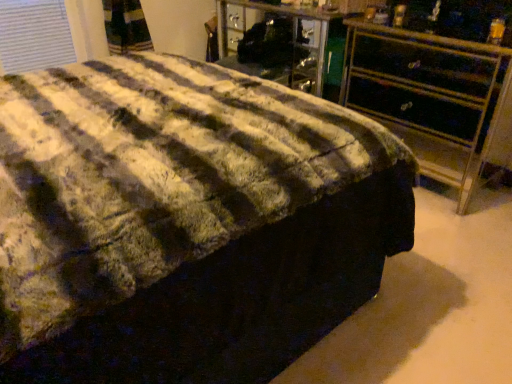
The height and width of the screenshot is (384, 512). What do you see at coordinates (185, 221) in the screenshot?
I see `fluffy fabric bed at center` at bounding box center [185, 221].

I want to click on fluffy fabric bed at center, so click(185, 221).

At what (x,y) coordinates should I click in order to perform the action: click on metallic gold chest of drawers at right. Please return your answer as a coordinate pair (x, y). Looking at the image, I should click on (433, 98).

The height and width of the screenshot is (384, 512). Describe the element at coordinates (433, 98) in the screenshot. I see `metallic gold chest of drawers at right` at that location.

You are a GUI agent. You are given a task and a screenshot of the screen. Output one action in this format:
    pyautogui.click(x=<x>, y=<y>)
    Task: Click on the fluffy fabric bed at center
    
    Given the screenshot: What is the action you would take?
    pyautogui.click(x=185, y=221)

Can you confirm if fluffy fabric bed at center is positioned to the right of metallic gold chest of drawers at right?

In fact, fluffy fabric bed at center is to the left of metallic gold chest of drawers at right.

Is fluffy fabric bed at center behind metallic gold chest of drawers at right?

No, the depth of fluffy fabric bed at center is less than that of metallic gold chest of drawers at right.

Which is nearer, [218,141] or [445,123]?

Point [218,141] appears to be closer to the viewer than point [445,123].

From the image's perspective, is fluffy fabric bed at center located above metallic gold chest of drawers at right?

Actually, fluffy fabric bed at center appears below metallic gold chest of drawers at right in the image.

Looking at this image, from a real-world perspective, is fluffy fabric bed at center on metallic gold chest of drawers at right?

Yes, from a real-world perspective, fluffy fabric bed at center is on top of metallic gold chest of drawers at right.

Looking at their sizes, would you say fluffy fabric bed at center is wider or thinner than metallic gold chest of drawers at right?

Clearly, fluffy fabric bed at center has more width compared to metallic gold chest of drawers at right.

Between fluffy fabric bed at center and metallic gold chest of drawers at right, which one has less height?

With less height is metallic gold chest of drawers at right.

Considering the sizes of fluffy fabric bed at center and metallic gold chest of drawers at right in the image, is fluffy fabric bed at center bigger or smaller than metallic gold chest of drawers at right?

fluffy fabric bed at center is bigger than metallic gold chest of drawers at right.

Is fluffy fabric bed at center not inside metallic gold chest of drawers at right?

Indeed, fluffy fabric bed at center is completely outside metallic gold chest of drawers at right.

Is fluffy fabric bed at center far away from metallic gold chest of drawers at right?

Yes, fluffy fabric bed at center is far from metallic gold chest of drawers at right.

Is fluffy fabric bed at center oriented towards metallic gold chest of drawers at right?

Yes, fluffy fabric bed at center is aimed at metallic gold chest of drawers at right.

How many degrees apart are the facing directions of fluffy fabric bed at center and metallic gold chest of drawers at right?

There is a 177-degree angle between the facing directions of fluffy fabric bed at center and metallic gold chest of drawers at right.

How much distance is there between fluffy fabric bed at center and metallic gold chest of drawers at right?

fluffy fabric bed at center is 3.49 feet away from metallic gold chest of drawers at right.

I want to click on the chest of drawers behind the fluffy fabric bed at center, so click(x=433, y=98).

Which is more to the left, metallic gold chest of drawers at right or fluffy fabric bed at center?

From the viewer's perspective, fluffy fabric bed at center appears more on the left side.

Is the depth of metallic gold chest of drawers at right less than that of fluffy fabric bed at center?

No, it is not.

Considering the points (396, 123) and (45, 280), which point is behind, point (396, 123) or point (45, 280)?

Positioned behind is point (396, 123).

From the image's perspective, is metallic gold chest of drawers at right located above or below fluffy fabric bed at center?

From the image's perspective, metallic gold chest of drawers at right appears above fluffy fabric bed at center.

From a real-world perspective, is metallic gold chest of drawers at right positioned under fluffy fabric bed at center based on gravity?

Yes.

Considering the sizes of objects metallic gold chest of drawers at right and fluffy fabric bed at center in the image provided, who is thinner, metallic gold chest of drawers at right or fluffy fabric bed at center?

With smaller width is metallic gold chest of drawers at right.

Who is taller, metallic gold chest of drawers at right or fluffy fabric bed at center?

fluffy fabric bed at center.

Can you confirm if metallic gold chest of drawers at right is smaller than fluffy fabric bed at center?

Yes, metallic gold chest of drawers at right is smaller than fluffy fabric bed at center.

Is metallic gold chest of drawers at right positioned beyond the bounds of fluffy fabric bed at center?

metallic gold chest of drawers at right is positioned outside fluffy fabric bed at center.

Based on the photo, is the surface of metallic gold chest of drawers at right in direct contact with fluffy fabric bed at center?

No, metallic gold chest of drawers at right is not making contact with fluffy fabric bed at center.

Is metallic gold chest of drawers at right looking in the opposite direction of fluffy fabric bed at center?

No, metallic gold chest of drawers at right is not facing the opposite direction of fluffy fabric bed at center.

Identify the location of chest of drawers above the fluffy fabric bed at center (from the image's perspective). (433, 98).

Find the location of `chest of drawers behind the fluffy fabric bed at center`. chest of drawers behind the fluffy fabric bed at center is located at coordinates pos(433,98).

The height and width of the screenshot is (384, 512). What are the coordinates of `bed on the left of metallic gold chest of drawers at right` in the screenshot? It's located at (185, 221).